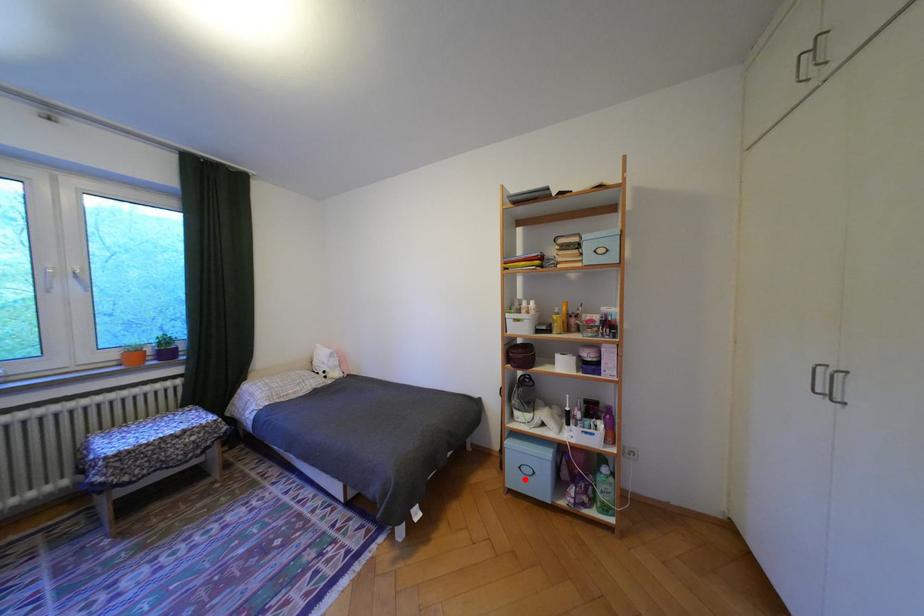
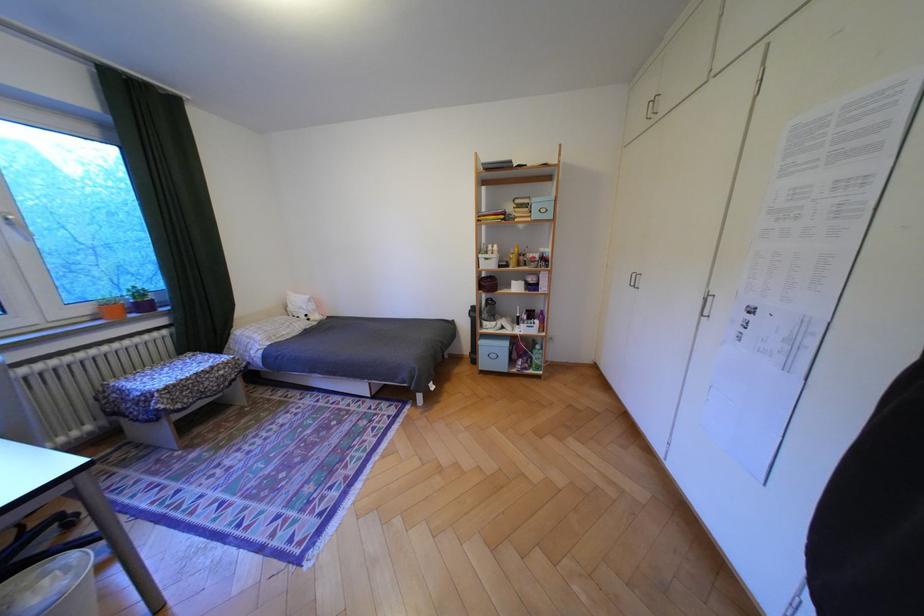
The point at the highlighted location is marked in the first image. Where is the corresponding point in the second image?

(495, 363)